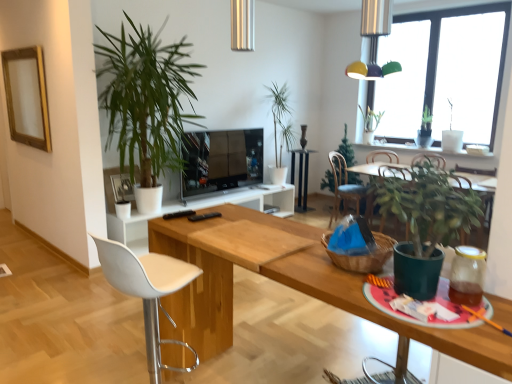
Question: Is blue fabric chair at center, the 2th chair viewed from the left, positioned beyond the bounds of flat screen tv at center?

Choices:
 (A) yes
 (B) no

Answer: (A)

Question: Does blue fabric chair at center, which is counted as the 1th chair, starting from the right, have a lesser height compared to flat screen tv at center?

Choices:
 (A) no
 (B) yes

Answer: (A)

Question: From the image's perspective, is blue fabric chair at center, which is counted as the 1th chair, starting from the right, below flat screen tv at center?

Choices:
 (A) yes
 (B) no

Answer: (A)

Question: Is the depth of blue fabric chair at center, placed as the 1th chair when sorted from back to front, less than that of flat screen tv at center?

Choices:
 (A) yes
 (B) no

Answer: (B)

Question: Is blue fabric chair at center, the 2th chair viewed from the left, behind flat screen tv at center?

Choices:
 (A) yes
 (B) no

Answer: (A)

Question: Does blue fabric chair at center, the 2th chair viewed from the left, have a larger size compared to black glossy side table at center?

Choices:
 (A) no
 (B) yes

Answer: (B)

Question: From the image's perspective, is blue fabric chair at center, which is the 2th chair from front to back, on black glossy side table at center?

Choices:
 (A) no
 (B) yes

Answer: (A)

Question: Is blue fabric chair at center, which is the 2th chair from front to back, beside black glossy side table at center?

Choices:
 (A) no
 (B) yes

Answer: (A)

Question: Is blue fabric chair at center, which is counted as the 1th chair, starting from the right, positioned behind black glossy side table at center?

Choices:
 (A) no
 (B) yes

Answer: (A)

Question: Is blue fabric chair at center, which is counted as the 1th chair, starting from the right, positioned beyond the bounds of black glossy side table at center?

Choices:
 (A) no
 (B) yes

Answer: (B)

Question: Considering the relative sizes of blue fabric chair at center, which is the 2th chair from front to back, and black glossy side table at center in the image provided, is blue fabric chair at center, which is the 2th chair from front to back, wider than black glossy side table at center?

Choices:
 (A) yes
 (B) no

Answer: (A)

Question: From a real-world perspective, is black glossy side table at center below brown woven basket at center?

Choices:
 (A) yes
 (B) no

Answer: (A)